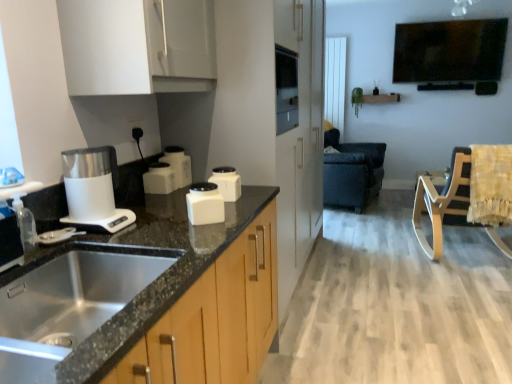
Question: Would you say white matte container at center, the 2th kitchen appliance positioned from the front, is a long distance from white glossy container at center, marked as the 2th kitchen appliance in a back-to-front arrangement?

Choices:
 (A) no
 (B) yes

Answer: (A)

Question: From the image's perspective, would you say white matte container at center, the 3th kitchen appliance from the back, is shown under white glossy container at center, the third kitchen appliance in the front-to-back sequence?

Choices:
 (A) no
 (B) yes

Answer: (B)

Question: From the image's perspective, would you say white matte container at center, the 3th kitchen appliance from the back, is positioned over white glossy container at center, marked as the 2th kitchen appliance in a back-to-front arrangement?

Choices:
 (A) yes
 (B) no

Answer: (B)

Question: Is white matte container at center, the 2th kitchen appliance positioned from the front, completely or partially outside of white glossy container at center, marked as the 2th kitchen appliance in a back-to-front arrangement?

Choices:
 (A) yes
 (B) no

Answer: (A)

Question: Does white matte container at center, the 2th kitchen appliance positioned from the front, have a smaller size compared to white glossy container at center, marked as the 2th kitchen appliance in a back-to-front arrangement?

Choices:
 (A) no
 (B) yes

Answer: (B)

Question: Is white matte container at center, the 3th kitchen appliance from the back, positioned before white glossy container at center, the third kitchen appliance in the front-to-back sequence?

Choices:
 (A) yes
 (B) no

Answer: (A)

Question: Would you say yellow fabric swivel chair at right is part of white glossy container at center, marked as the 2th kitchen appliance in a back-to-front arrangement,'s contents?

Choices:
 (A) no
 (B) yes

Answer: (A)

Question: Is the depth of white glossy container at center, the third kitchen appliance in the front-to-back sequence, less than that of yellow fabric swivel chair at right?

Choices:
 (A) no
 (B) yes

Answer: (B)

Question: Considering the relative sizes of white glossy container at center, marked as the 2th kitchen appliance in a back-to-front arrangement, and yellow fabric swivel chair at right in the image provided, is white glossy container at center, marked as the 2th kitchen appliance in a back-to-front arrangement, wider than yellow fabric swivel chair at right?

Choices:
 (A) yes
 (B) no

Answer: (B)

Question: From a real-world perspective, is white glossy container at center, the third kitchen appliance in the front-to-back sequence, physically below yellow fabric swivel chair at right?

Choices:
 (A) yes
 (B) no

Answer: (B)

Question: Can you confirm if white glossy container at center, marked as the 2th kitchen appliance in a back-to-front arrangement, is shorter than yellow fabric swivel chair at right?

Choices:
 (A) yes
 (B) no

Answer: (A)

Question: Is white glossy container at center, the third kitchen appliance in the front-to-back sequence, positioned far away from yellow fabric swivel chair at right?

Choices:
 (A) no
 (B) yes

Answer: (B)

Question: Considering the relative positions of dark leather rocking chair at center, the second rocking chair positioned from the front, and clear plastic spray bottle at left in the image provided, is dark leather rocking chair at center, the second rocking chair positioned from the front, behind clear plastic spray bottle at left?

Choices:
 (A) no
 (B) yes

Answer: (B)